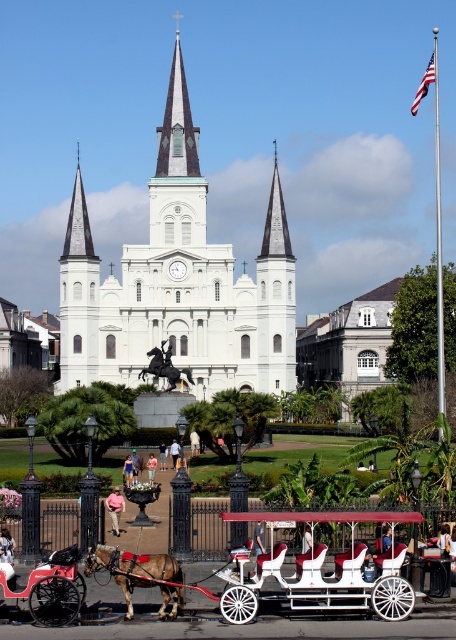
Question: Can you confirm if brown glossy horse at lower left is positioned above shiny black horse at center?

Choices:
 (A) no
 (B) yes

Answer: (A)

Question: Which point is farther to the camera?

Choices:
 (A) white wood wagon at center
 (B) white stone church at center
 (C) shiny black horse at center
 (D) polished wood horse cart at lower left

Answer: (B)

Question: From the image, what is the correct spatial relationship of polished wood horse cart at lower left in relation to brown glossy horse at lower left?

Choices:
 (A) left
 (B) right

Answer: (A)

Question: Which point is closer to the camera?

Choices:
 (A) polished wood horse cart at lower left
 (B) white stone church at center
 (C) white wood wagon at center
 (D) brown glossy horse at lower left

Answer: (C)

Question: Is white stone church at center thinner than brown glossy horse at lower left?

Choices:
 (A) no
 (B) yes

Answer: (A)

Question: Which object is the farthest from the polished wood horse cart at lower left?

Choices:
 (A) white stone church at center
 (B) white wood wagon at center
 (C) brown glossy horse at lower left

Answer: (A)